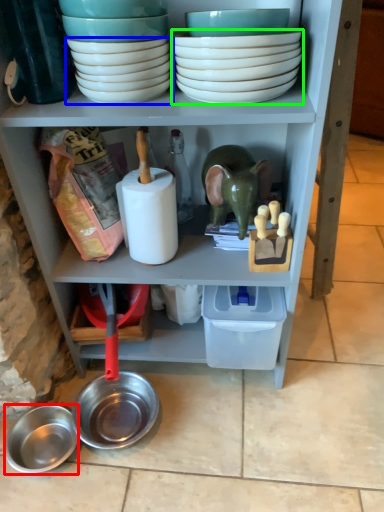
Question: Which is farther away from bowl (highlighted by a red box)? bowl (highlighted by a blue box) or bowl (highlighted by a green box)?

Choices:
 (A) bowl
 (B) bowl

Answer: (B)